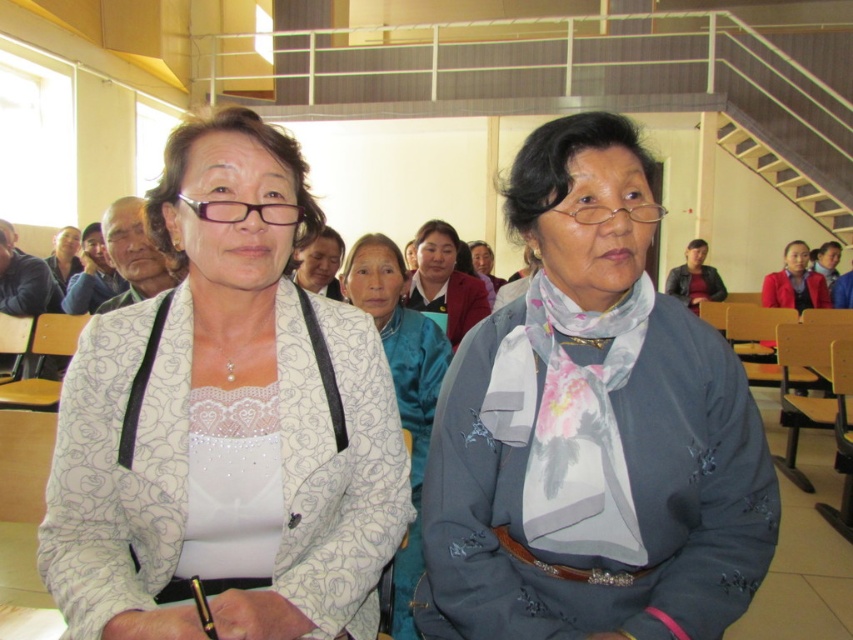
Based on the photo, is blue silk scarf at center thinner than matte gray scarf at center?

No, blue silk scarf at center is not thinner than matte gray scarf at center.

Who is more forward, [379,252] or [328,234]?

Point [379,252] is more forward.

Where is `blue silk scarf at center`? This screenshot has height=640, width=853. blue silk scarf at center is located at coordinates (399, 387).

Does point (517, 400) come farther from viewer compared to point (686, 266)?

That is False.

Is point (657, 476) less distant than point (697, 253)?

Yes, it is in front of point (697, 253).

The width and height of the screenshot is (853, 640). What are the coordinates of `gray fabric scarf at center` in the screenshot? It's located at (593, 426).

Describe the element at coordinates (225, 422) in the screenshot. The width and height of the screenshot is (853, 640). I see `white lace blouse at center` at that location.

From the picture: Is white lace blouse at center positioned before matte black jacket at upper left?

Yes, white lace blouse at center is closer to the viewer.

Is point (262, 145) positioned before point (83, 243)?

Yes, it is.

Image resolution: width=853 pixels, height=640 pixels. In order to click on white lace blouse at center in this screenshot , I will do `click(225, 422)`.